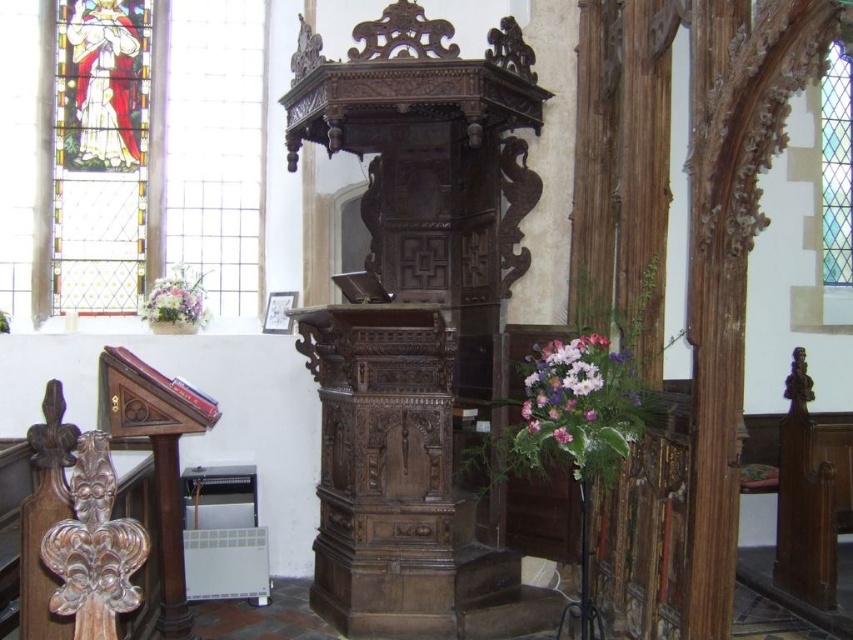
You are an interior designer assessing the church layout. You need to determine which stained glass element has a greater width between the stained glass figure at upper left and the stained glass window at upper right. Based on the scene, which one is wider?

The stained glass figure at upper left is wider than the stained glass window at upper right according to the description.